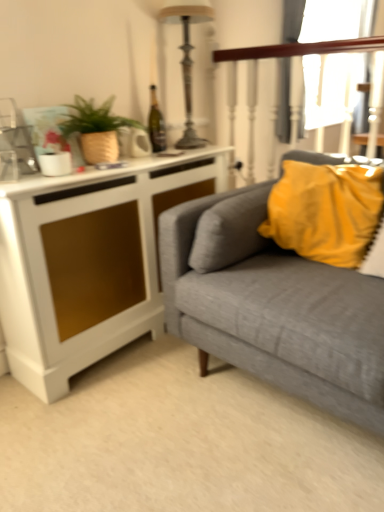
Question: Can you confirm if white matte cabinet at left is wider than wooden polished rail at upper right?

Choices:
 (A) no
 (B) yes

Answer: (B)

Question: Is white matte cabinet at left positioned beyond the bounds of wooden polished rail at upper right?

Choices:
 (A) no
 (B) yes

Answer: (B)

Question: Considering the relative sizes of white matte cabinet at left and wooden polished rail at upper right in the image provided, is white matte cabinet at left shorter than wooden polished rail at upper right?

Choices:
 (A) no
 (B) yes

Answer: (B)

Question: From a real-world perspective, is white matte cabinet at left below wooden polished rail at upper right?

Choices:
 (A) yes
 (B) no

Answer: (A)

Question: Does white matte cabinet at left come behind wooden polished rail at upper right?

Choices:
 (A) yes
 (B) no

Answer: (B)

Question: Is point (213, 186) closer or farther from the camera than point (312, 42)?

Choices:
 (A) closer
 (B) farther

Answer: (A)

Question: From the image's perspective, relative to wooden polished rail at upper right, is white matte cabinet at left above or below?

Choices:
 (A) above
 (B) below

Answer: (B)

Question: In the image, is white matte cabinet at left on the left side or the right side of wooden polished rail at upper right?

Choices:
 (A) right
 (B) left

Answer: (B)

Question: In terms of width, does white matte cabinet at left look wider or thinner when compared to wooden polished rail at upper right?

Choices:
 (A) thin
 (B) wide

Answer: (B)

Question: Is white matte cabinet at left in front of or behind yellow fabric pillow at upper right in the image?

Choices:
 (A) behind
 (B) front

Answer: (B)

Question: Based on their sizes in the image, would you say white matte cabinet at left is bigger or smaller than yellow fabric pillow at upper right?

Choices:
 (A) small
 (B) big

Answer: (B)

Question: Is point (26, 200) closer or farther from the camera than point (279, 219)?

Choices:
 (A) farther
 (B) closer

Answer: (B)

Question: From their relative heights in the image, would you say white matte cabinet at left is taller or shorter than yellow fabric pillow at upper right?

Choices:
 (A) short
 (B) tall

Answer: (B)

Question: Looking at their shapes, would you say white matte cabinet at left is wider or thinner than textured gray couch at right?

Choices:
 (A) wide
 (B) thin

Answer: (B)

Question: Is white matte cabinet at left spatially inside textured gray couch at right, or outside of it?

Choices:
 (A) outside
 (B) inside

Answer: (A)